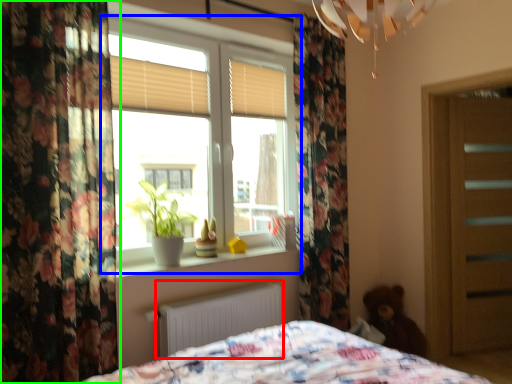
Question: Which object is positioned closest to radiator (highlighted by a red box)? Select from window (highlighted by a blue box) and curtain (highlighted by a green box).

Choices:
 (A) window
 (B) curtain

Answer: (B)